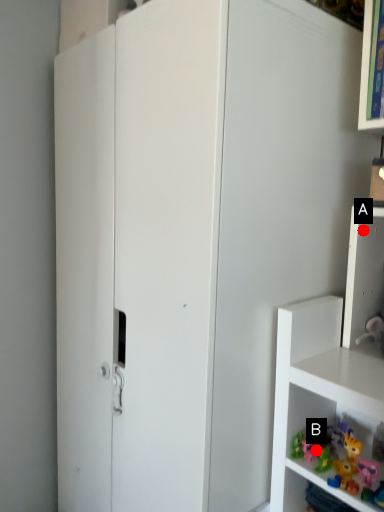
Question: Two points are circled on the image, labeled by A and B beside each circle. Which point is further to the camera?

Choices:
 (A) A is further
 (B) B is further

Answer: (A)